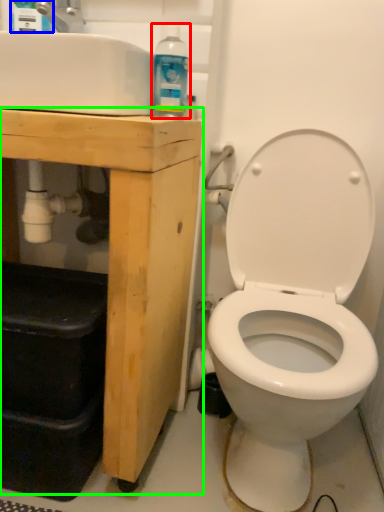
Question: Which is nearer to the cleaning product (highlighted by a red box)? cleaning product (highlighted by a blue box) or porcelain (highlighted by a green box).

Choices:
 (A) cleaning product
 (B) porcelain

Answer: (B)